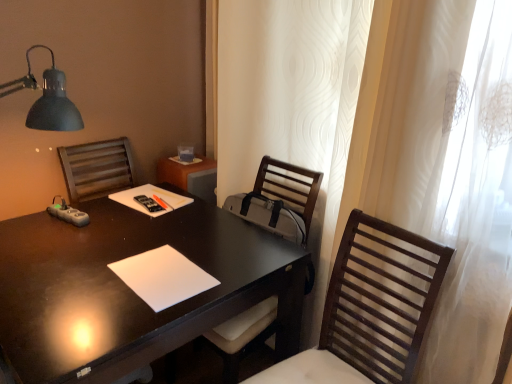
Locate an element on the screen. This screenshot has height=384, width=512. free location to the right of white matte notepad at center is located at coordinates (249, 262).